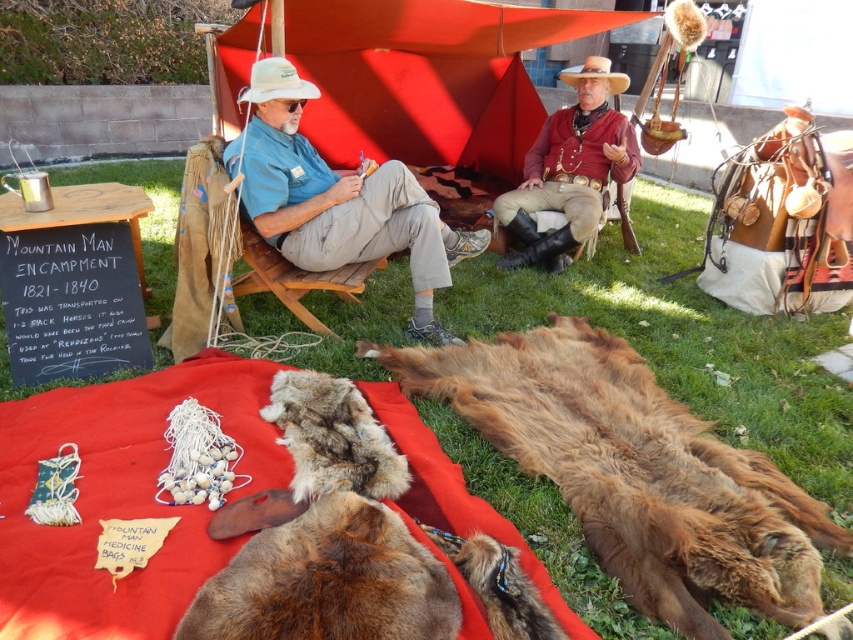
You are standing at the edge of the red cloth and see the two pelts displayed on it. Which pelt, the one at point (300,282) or the one at point (612,81), is closer to you?

The pelt at point (300,282) is closer to you because it is in front of the pelt at point (612,81).

You are a participant at the Mountain Man Encampment event and want to place a small souvenir on the display. Which item, the brown fur pelt at lower center or the rustic leather cowboy hat at upper center, has a larger surface area to place the souvenir?

The brown fur pelt at lower center has a larger surface area than the rustic leather cowboy hat at upper center because its width surpasses the hat.